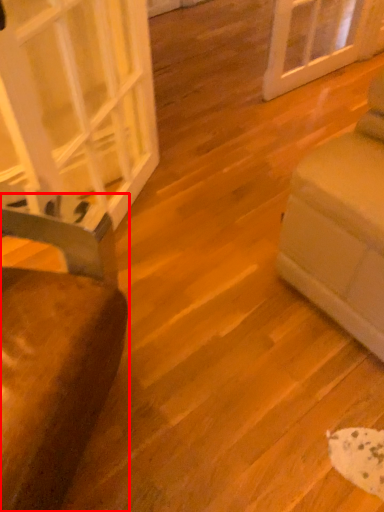
Question: From the image's perspective, where is furniture (annotated by the red box) located relative to glass door?

Choices:
 (A) above
 (B) below

Answer: (B)